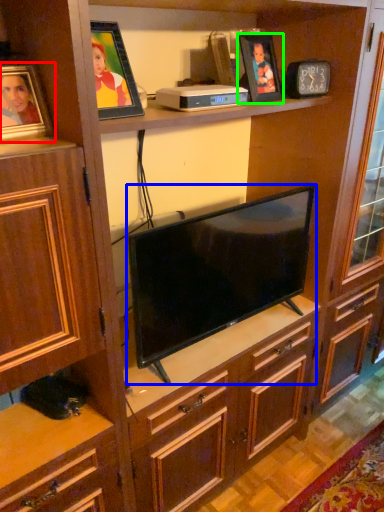
Question: Estimate the real-world distances between objects in this image. Which object is closer to picture frame (highlighted by a red box), television (highlighted by a blue box) or picture frame (highlighted by a green box)?

Choices:
 (A) television
 (B) picture frame

Answer: (A)